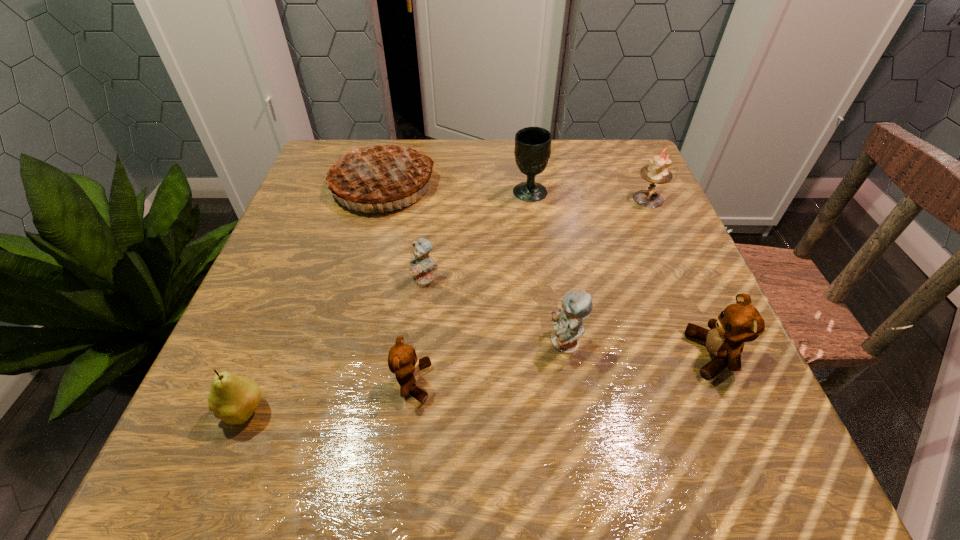
This screenshot has width=960, height=540. In order to click on the closest teddy bear to the rightmost teddy bear in this screenshot , I will do `click(576, 306)`.

At what (x,y) coordinates should I click in order to perform the action: click on the second closest teddy bear to the left blue teddy bear. Please return your answer as a coordinate pair (x, y). This screenshot has height=540, width=960. Looking at the image, I should click on [x=576, y=306].